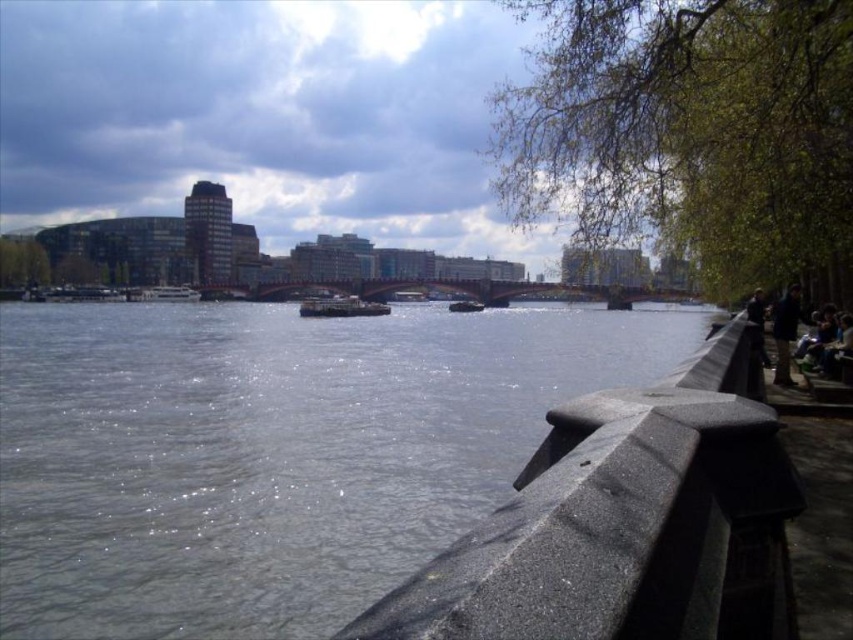
You are standing on the riverside path and want to take a photo of the gray concrete river at center and the dark blue jacket at right. To ensure both are in the frame, should you position yourself to the left or right of the jacket?

You should position yourself to the left of the dark blue jacket at right because the gray concrete river at center is to the left of the dark blue jacket at right, so placing yourself left of the jacket will keep both in view.

Based on the photo, you are standing at the riverside and want to pick up the dark gray fabric jacket at right. However, there is a gray concrete rail at lower right in your way. Can you reach the jacket without crossing the rail?

The gray concrete rail at lower right is 31.43 meters away from dark gray fabric jacket at right. Since the rail is not between you and the jacket, you can reach the jacket without crossing the rail.

You are standing at the riverside and see two points marked on the image. The first point is at coordinates point (x=355, y=545) and the second point is at point (x=784, y=305). Which point is closer to you?

Point (x=355, y=545) is in front of point (x=784, y=305), so it is closer to you.